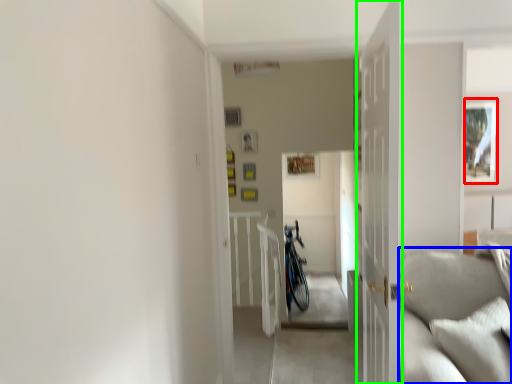
Question: Considering the real-world distances, which object is farthest from picture frame (highlighted by a red box)? couch (highlighted by a blue box) or door (highlighted by a green box)?

Choices:
 (A) couch
 (B) door

Answer: (B)